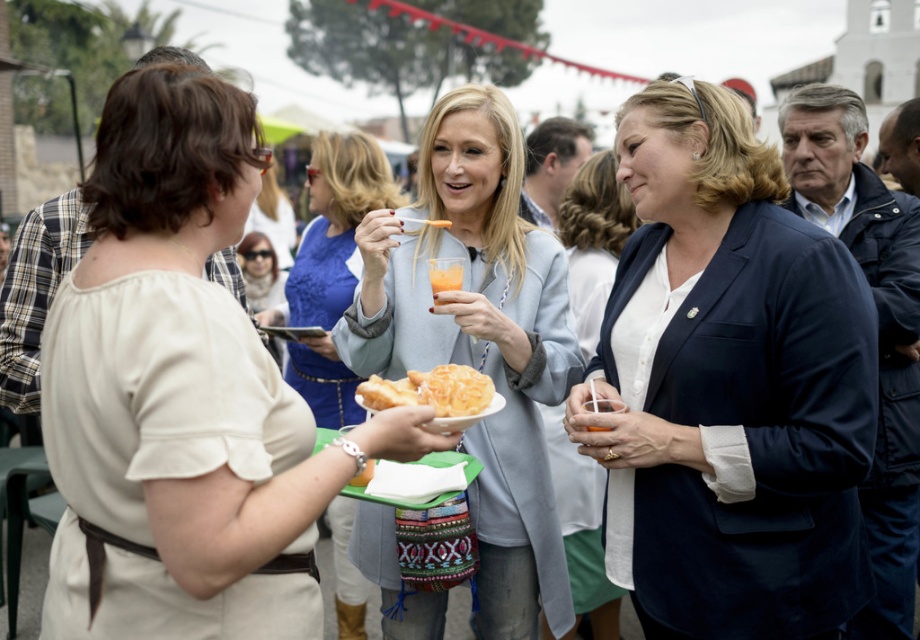
Question: Can you confirm if navy blue blazer at center is positioned above white matte blazer at center?

Choices:
 (A) yes
 (B) no

Answer: (B)

Question: Estimate the real-world distances between objects in this image. Which object is farther from the translucent plastic cup at center?

Choices:
 (A) white matte blazer at center
 (B) matte beige blouse at center
 (C) navy blue blazer at center

Answer: (B)

Question: Observing the image, what is the correct spatial positioning of white matte blazer at center in reference to golden crispy pastry at center?

Choices:
 (A) right
 (B) left

Answer: (A)

Question: Among these points, which one is farthest from the camera?

Choices:
 (A) (447, 288)
 (B) (420, 262)
 (C) (746, 288)
 (D) (464, 365)

Answer: (B)

Question: Is the position of matte beige blouse at center less distant than that of translucent plastic cup at center?

Choices:
 (A) yes
 (B) no

Answer: (A)

Question: Which object is closer to the camera taking this photo?

Choices:
 (A) blue lace dress at center
 (B) navy blue blazer at center
 (C) translucent plastic cup at center
 (D) golden crispy pastry at center

Answer: (D)